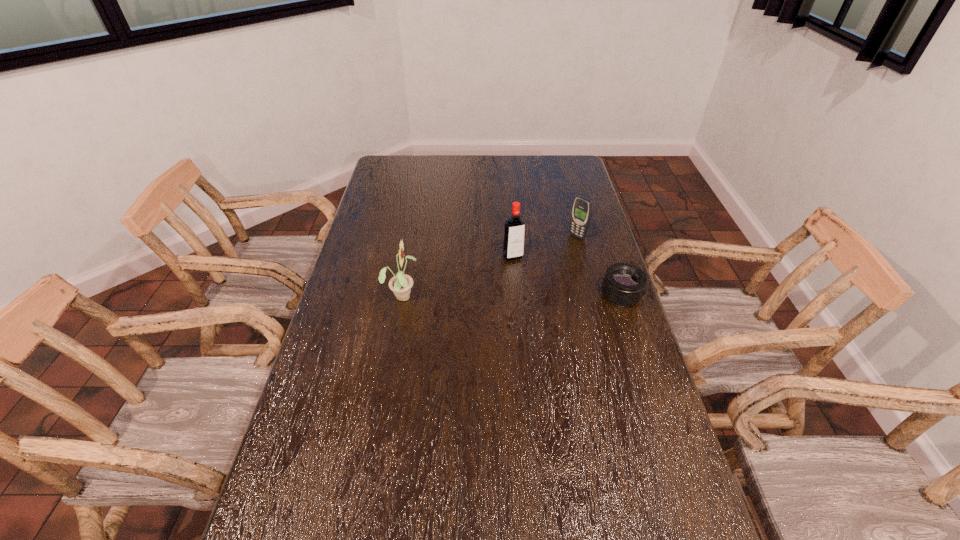
You are a GUI agent. You are given a task and a screenshot of the screen. Output one action in this format:
    pyautogui.click(x=<x>, y=<y>)
    Task: Click on the blank region between the leftmost object and the third nearest object
    The width and height of the screenshot is (960, 540).
    Given the screenshot: What is the action you would take?
    pyautogui.click(x=458, y=276)

You are a GUI agent. You are given a task and a screenshot of the screen. Output one action in this format:
    pyautogui.click(x=<x>, y=<y>)
    Task: Click on the vacant region between the shortest object and the leftmost object
    Image resolution: width=960 pixels, height=540 pixels.
    Given the screenshot: What is the action you would take?
    pyautogui.click(x=512, y=295)

Where is `free spot between the sunflower and the farthest object`? This screenshot has width=960, height=540. free spot between the sunflower and the farthest object is located at coordinates tap(490, 266).

Identify the location of unoccupied position between the leftmost object and the third nearest object. The height and width of the screenshot is (540, 960). (458, 276).

Identify the location of vacant space that is in between the vodka and the leftmost object. (458, 276).

Image resolution: width=960 pixels, height=540 pixels. Find the location of `vacant area that lies between the leftmost object and the second shortest object`. vacant area that lies between the leftmost object and the second shortest object is located at coordinates (490, 266).

Locate an element on the screen. vacant point located between the vodka and the telephoto lens is located at coordinates (567, 275).

At what (x,y) coordinates should I click in order to perform the action: click on vacant area that lies between the vodka and the telephoto lens. Please return your answer as a coordinate pair (x, y). This screenshot has height=540, width=960. Looking at the image, I should click on (567, 275).

The width and height of the screenshot is (960, 540). What are the coordinates of `free space between the leftmost object and the cellular telephone` in the screenshot? It's located at (490, 266).

Identify the location of vacant space that is in between the vodka and the leftmost object. (458, 276).